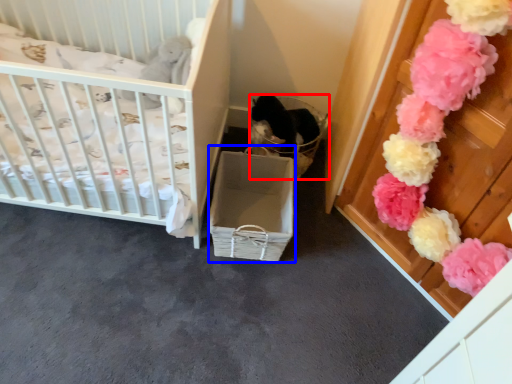
Question: Which object appears closest to the camera in this image, basket (highlighted by a red box) or crate (highlighted by a blue box)?

Choices:
 (A) basket
 (B) crate

Answer: (B)